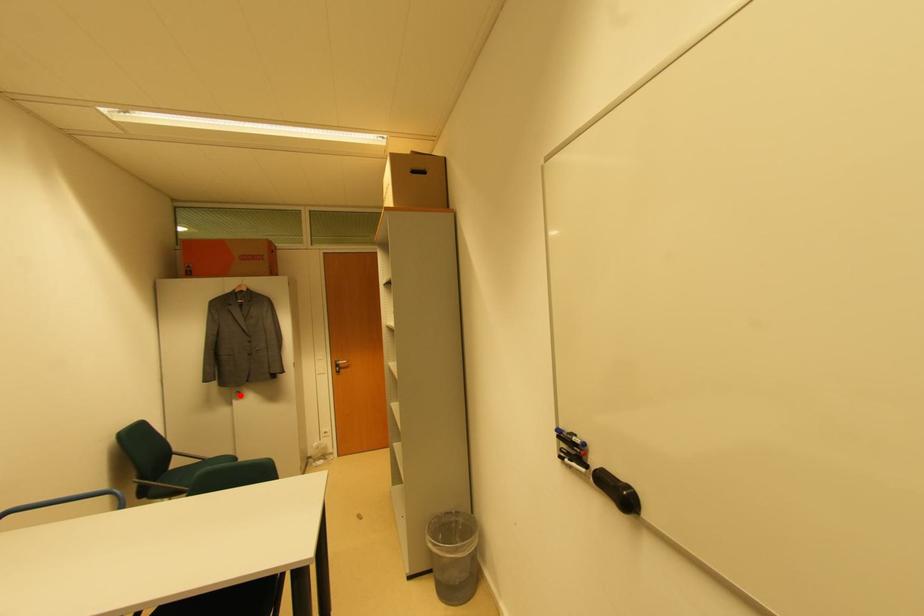
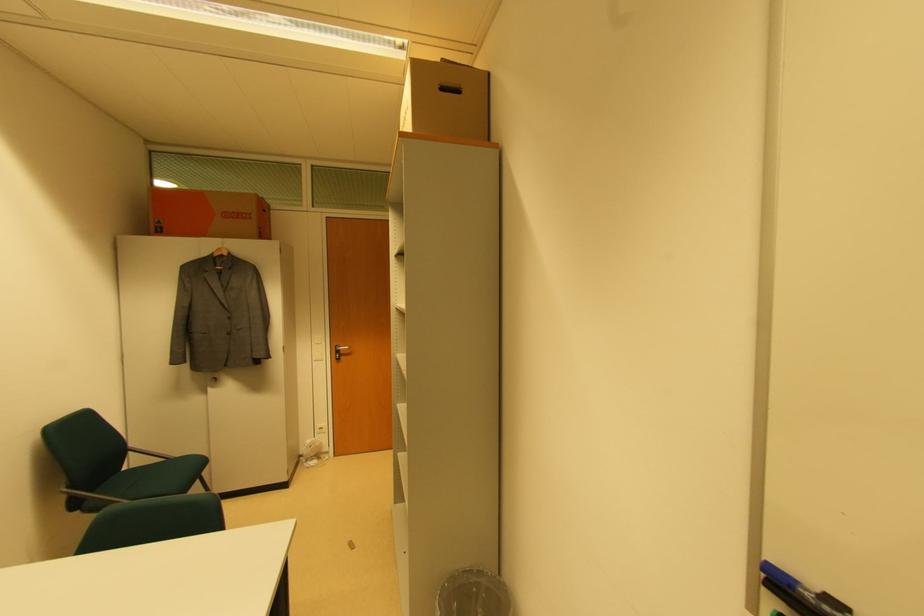
Question: I am providing you with two images of the same scene from different viewpoints. A red point is shown in image1. For the corresponding object point in image2, is it positioned nearer or farther from the camera?

Choices:
 (A) Nearer
 (B) Farther

Answer: (B)